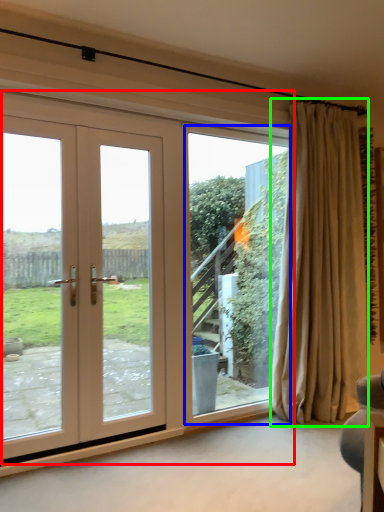
Question: Estimate the real-world distances between objects in this image. Which object is farther from door (highlighted by a red box), window screen (highlighted by a blue box) or curtain (highlighted by a green box)?

Choices:
 (A) window screen
 (B) curtain

Answer: (B)